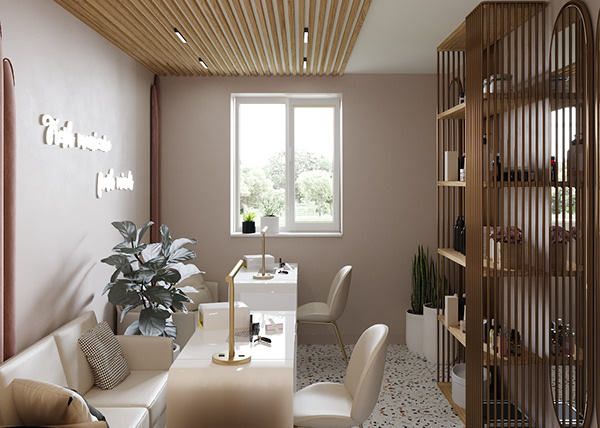
Locate an element on the screen. The image size is (600, 428). desk lamp is located at coordinates (230, 275), (263, 230).